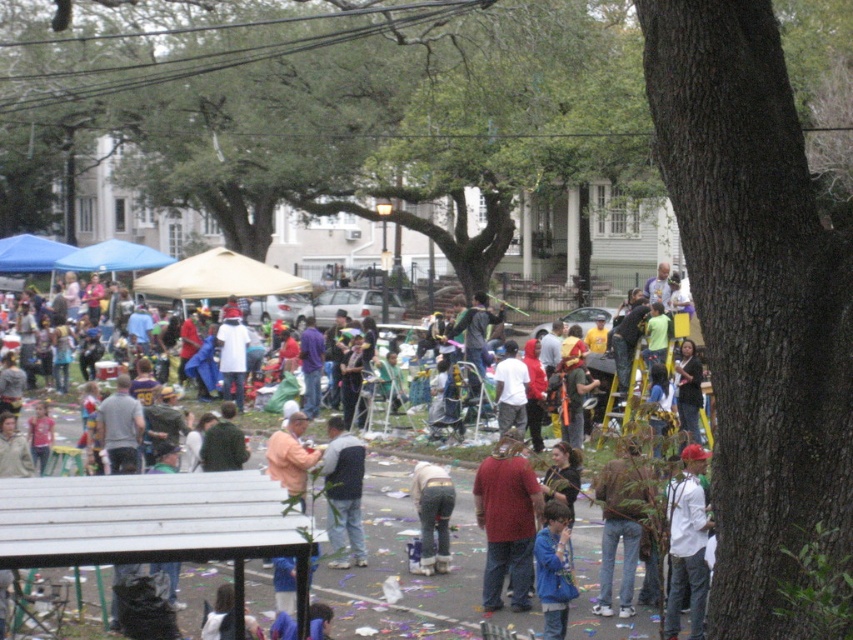
You are an event organizer trying to set up a new information booth. You want to place it in an area that is not blocked by the brown rough bark tree at right and has enough space for the matte red shirt at center to be visible. Is there enough space between them?

The brown rough bark tree at right occupies less space than the matte red shirt at center, so there is sufficient space between them to place the booth without blocking visibility of the matte red shirt at center.

You are standing at the camera position in the scene. There are two points marked in the image, one at coordinates point (x=734, y=253) and the other at point (x=506, y=541). Which point is closer to you?

Point (x=734, y=253) is closer to the camera than point (x=506, y=541).